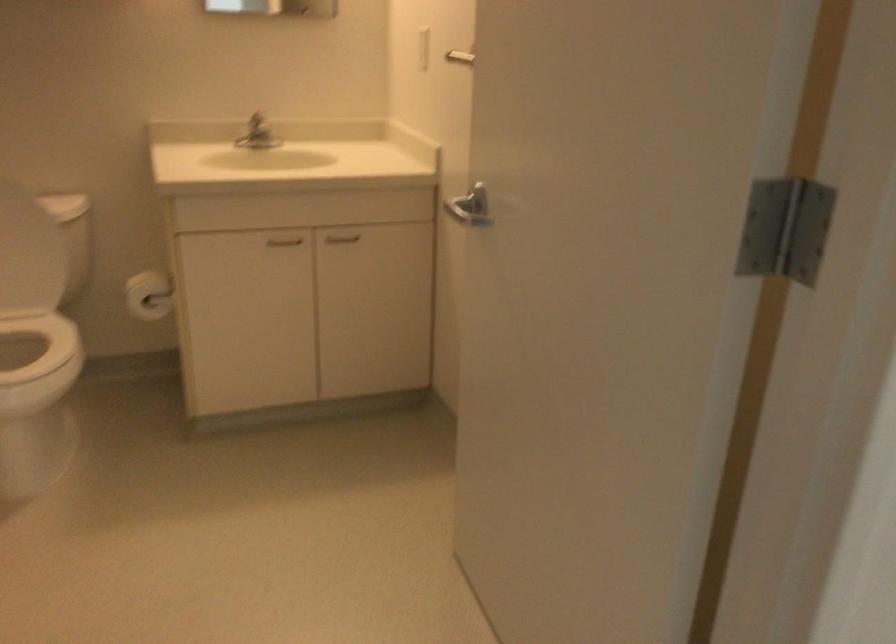
Where is `silver door handle`? This screenshot has height=644, width=896. silver door handle is located at coordinates (470, 205).